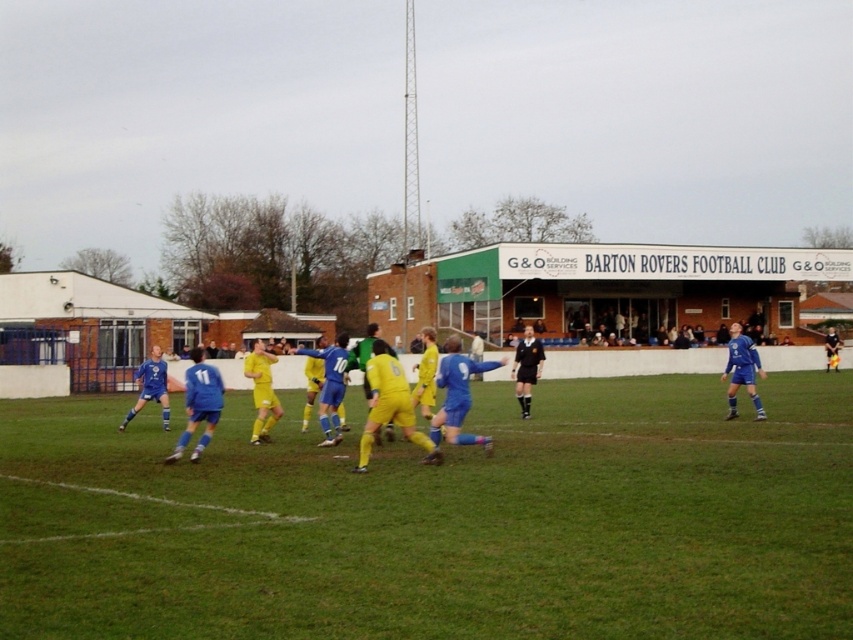
Measure the distance from yellow matte soccer players at center to black smooth shirt at center.

7.01 meters

You are a GUI agent. You are given a task and a screenshot of the screen. Output one action in this format:
    pyautogui.click(x=<x>, y=<y>)
    Task: Click on the yellow matte soccer players at center
    
    Given the screenshot: What is the action you would take?
    pyautogui.click(x=393, y=404)

What do you see at coordinates (393, 404) in the screenshot? I see `yellow matte soccer players at center` at bounding box center [393, 404].

Where is `yellow matte soccer players at center`? The image size is (853, 640). yellow matte soccer players at center is located at coordinates (393, 404).

Is green grass field at center in front of black smooth shirt at center?

That is True.

Who is shorter, green grass field at center or black smooth shirt at center?

Standing shorter between the two is green grass field at center.

Find the location of a particular element. green grass field at center is located at coordinates (440, 522).

From the picture: Can you confirm if green grass field at center is positioned above yellow matte soccer players at center?

No, green grass field at center is not above yellow matte soccer players at center.

Is green grass field at center positioned at the back of yellow matte soccer players at center?

No, it is not.

The width and height of the screenshot is (853, 640). Identify the location of green grass field at center. (440, 522).